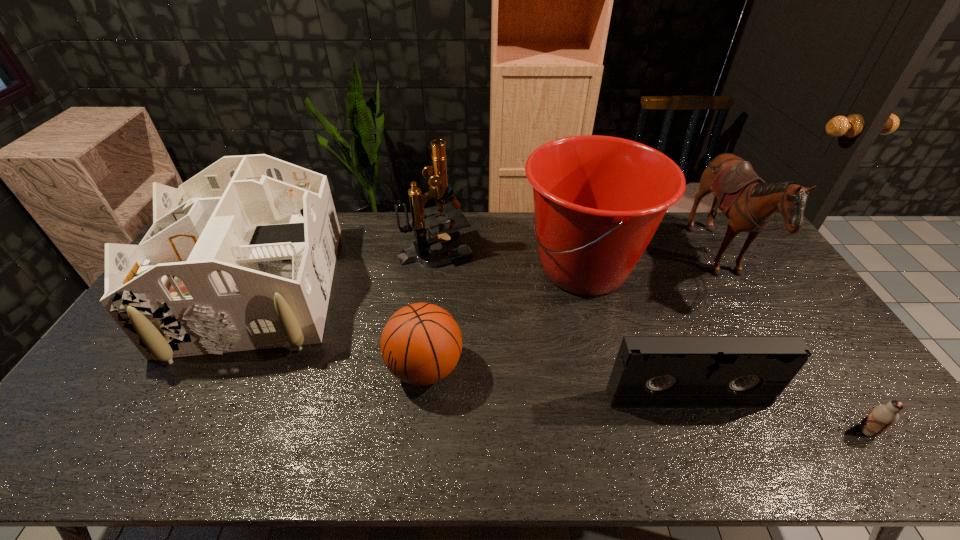
Where is `saddle present at the far edge`? saddle present at the far edge is located at coordinates (749, 203).

At what (x,y) coordinates should I click in order to perform the action: click on microscope that is at the far edge. Please return your answer as a coordinate pair (x, y). The image size is (960, 540). Looking at the image, I should click on (423, 219).

You are a GUI agent. You are given a task and a screenshot of the screen. Output one action in this format:
    pyautogui.click(x=<x>, y=<y>)
    Task: Click on the bucket at the far edge
    
    Given the screenshot: What is the action you would take?
    pyautogui.click(x=598, y=200)

Identify the location of dollhouse situated at the far edge. The height and width of the screenshot is (540, 960). (241, 256).

Identify the location of object that is at the near edge. The height and width of the screenshot is (540, 960). (882, 417).

The image size is (960, 540). Identify the location of object that is at the left edge. (241, 256).

Locate an element on the screen. This screenshot has height=540, width=960. saddle that is at the right edge is located at coordinates (749, 203).

Image resolution: width=960 pixels, height=540 pixels. Find the location of `chocolate milk at the right edge`. chocolate milk at the right edge is located at coordinates (882, 417).

Find the location of a particular element. The image size is (960, 540). object at the far left corner is located at coordinates (241, 256).

In order to click on object situated at the far right corner in this screenshot , I will do `click(749, 203)`.